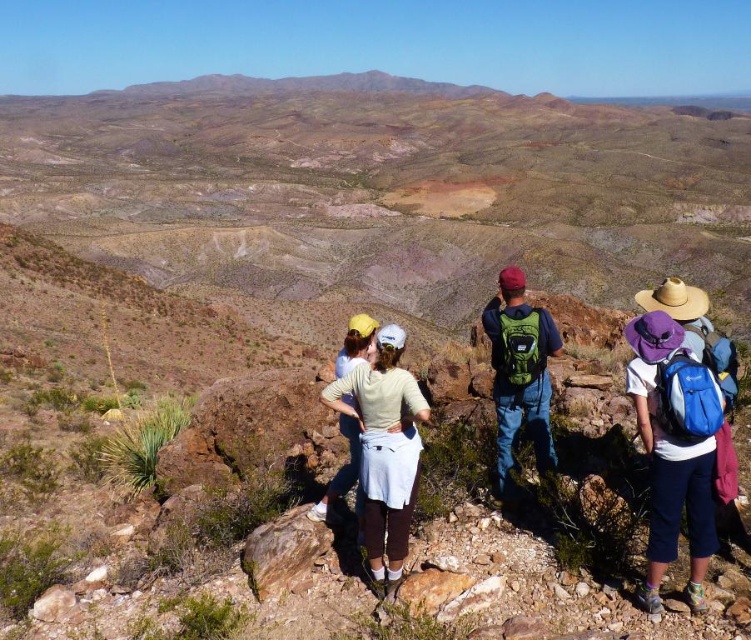
Question: Which object appears farthest from the camera in this image?

Choices:
 (A) white fabric skirt at center
 (B) blue fabric backpack at right

Answer: (A)

Question: Does blue fabric backpack at right have a smaller size compared to light blue denim jeans at center?

Choices:
 (A) no
 (B) yes

Answer: (B)

Question: Which point appears closest to the camera in this image?

Choices:
 (A) (357, 465)
 (B) (511, 376)
 (C) (692, 381)
 (D) (371, 394)

Answer: (C)

Question: Does white fabric skirt at center have a smaller size compared to green backpack at center?

Choices:
 (A) yes
 (B) no

Answer: (B)

Question: Does blue fabric backpack at right appear under white fabric skirt at center?

Choices:
 (A) no
 (B) yes

Answer: (B)

Question: Which object appears farthest from the camera in this image?

Choices:
 (A) white fabric skirt at center
 (B) blue fabric backpack at right

Answer: (A)